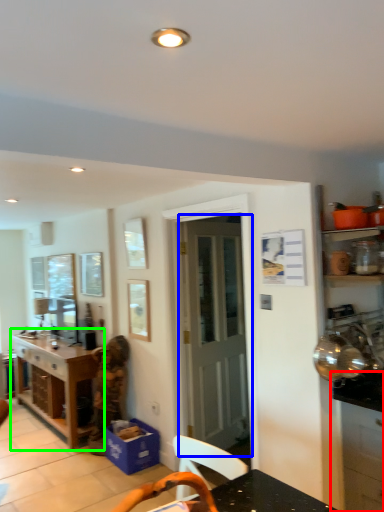
Question: Estimate the real-world distances between objects in this image. Which object is closer to cabinetry (highlighted by a red box), door (highlighted by a blue box) or table (highlighted by a green box)?

Choices:
 (A) door
 (B) table

Answer: (A)